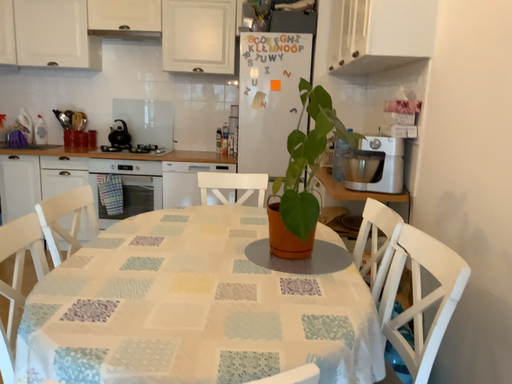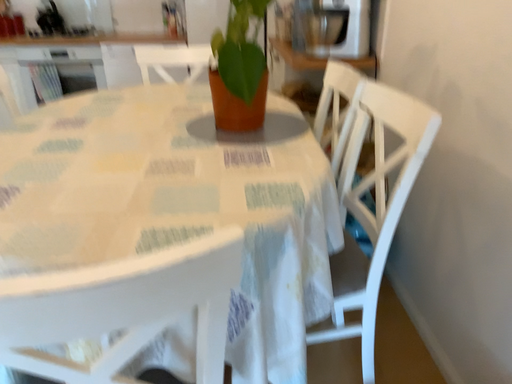
Question: How did the camera likely rotate when shooting the video?

Choices:
 (A) rotated downward
 (B) rotated upward

Answer: (A)